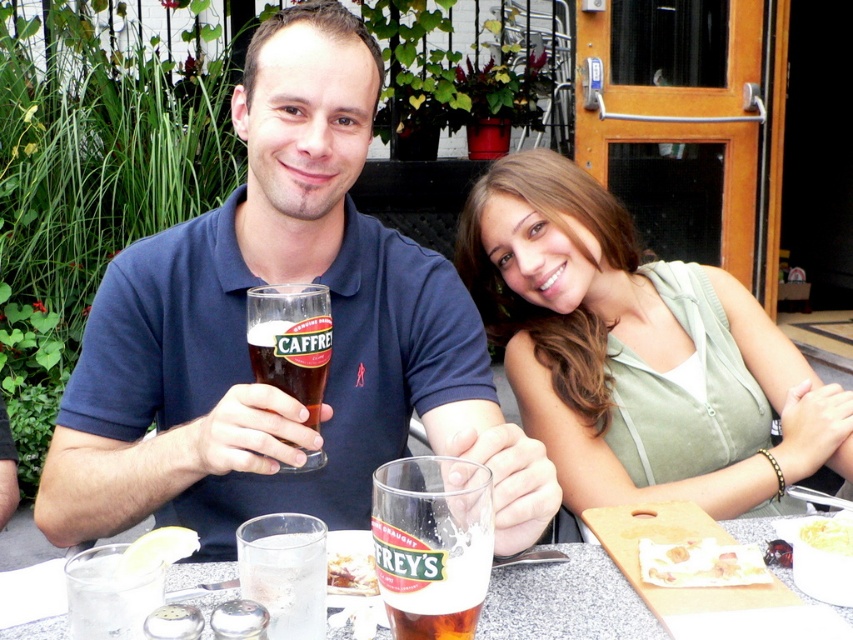
What is the color of the shirt worn by the person located at the coordinates point (245, 342) in the image?

The point (245, 342) indicates blue cotton shirt at center, so the color is blue.

You are a photographer setting up a shot of the blue cotton shirt at center and the dark brown glass at center. Which object should you focus on first if you want to ensure both are in frame without moving the camera?

The blue cotton shirt at center is larger in size than the dark brown glass at center, so you should focus on the blue cotton shirt at center first to ensure it fits within the frame before adjusting for the smaller dark brown glass at center.

What object is located at the coordinate point (566, 602) in the image?

The point (566, 602) corresponds to the translucent glass table at center.